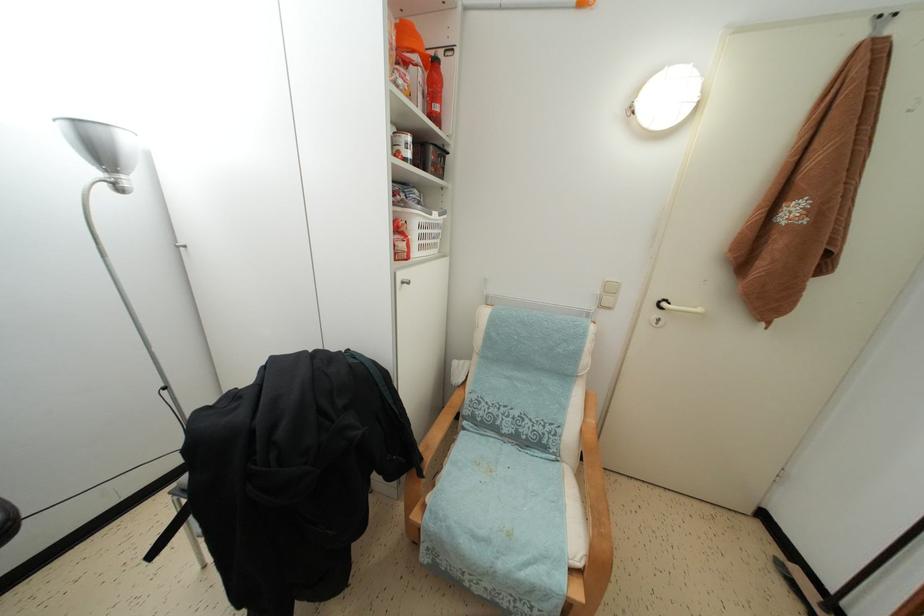
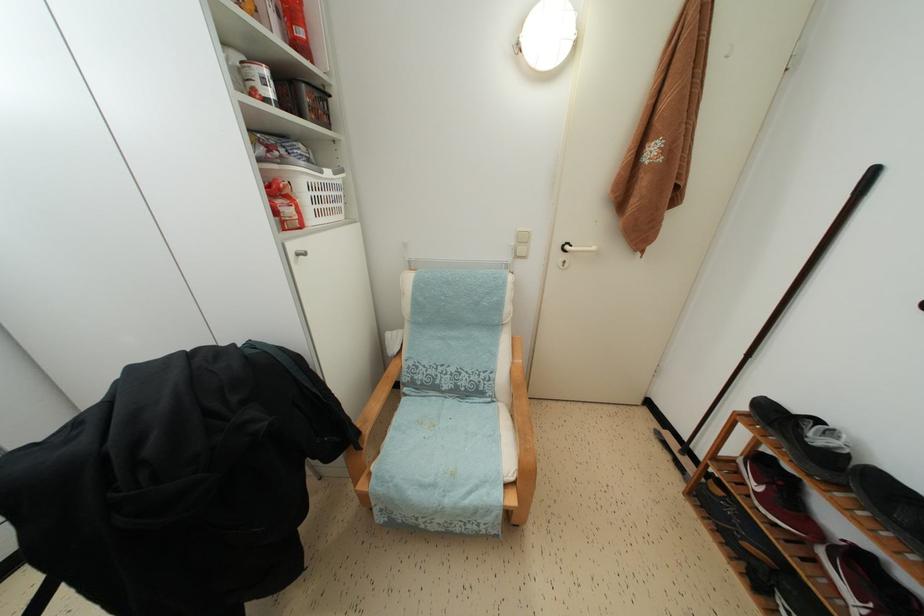
Find the pixel in the second image that matches (x=432, y=505) in the first image.

(377, 472)